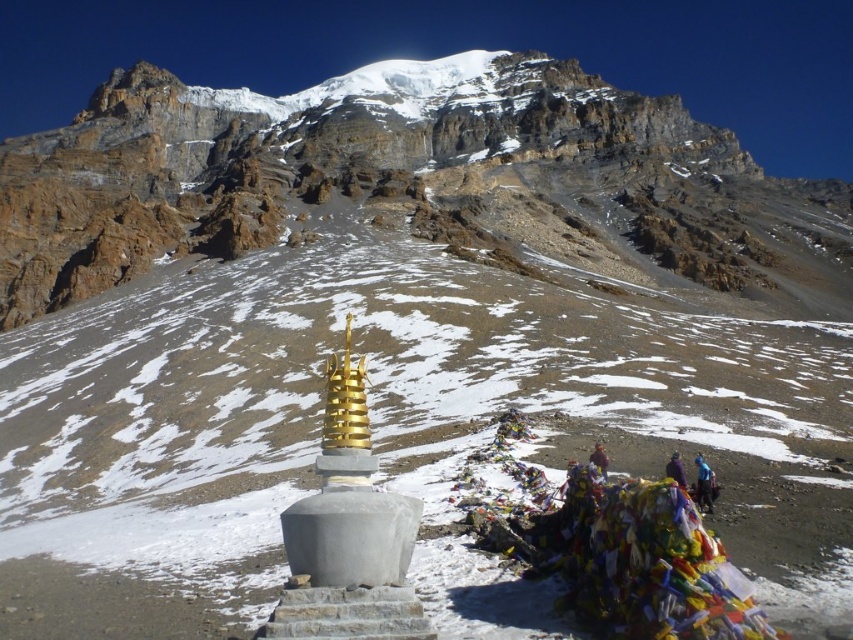
You are standing at the camera position observing the mountain landscape. There is a point marked at coordinates point (706, 465). Can you determine if this point is within a safe distance for a drone to land? The drone has a maximum operational distance of 70 meters.

The point (706, 465) is 71.26 meters away from the camera, which exceeds the drone s maximum operational distance of 70 meters. Therefore, the point is too far for the drone to land safely.

You are a hiker planning to take a photo of the white rocky mountain at center and the purple fabric at lower right from a viewpoint. Which object should you position to your left side to capture both in the frame?

To capture both the white rocky mountain at center and the purple fabric at lower right in the frame, position the white rocky mountain at center to your left side since it is already located to the left of the purple fabric at lower right.